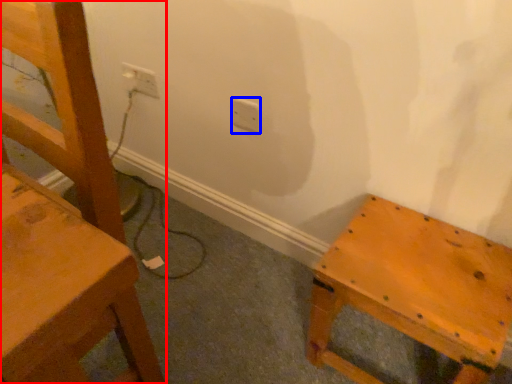
Question: Which object is closer to the camera taking this photo, chair (highlighted by a red box) or electric outlet (highlighted by a blue box)?

Choices:
 (A) chair
 (B) electric outlet

Answer: (A)